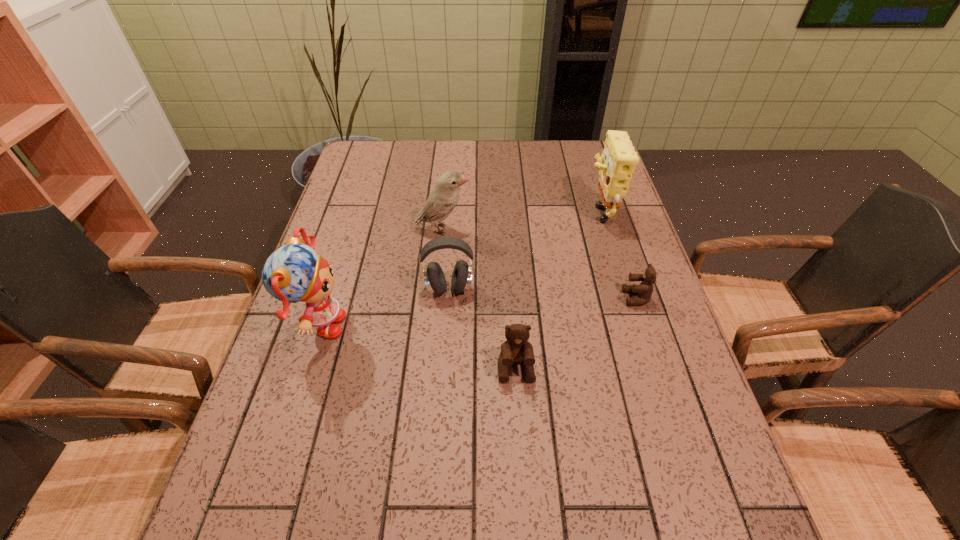
Where is `vacant space located 0.080m on the face of the shorter teddy bear`? Image resolution: width=960 pixels, height=540 pixels. vacant space located 0.080m on the face of the shorter teddy bear is located at coordinates (591, 298).

Locate an element on the screen. free space located on the face of the shorter teddy bear is located at coordinates (512, 298).

Locate an element on the screen. free region located at the face of the bird is located at coordinates (573, 230).

Locate an element on the screen. Image resolution: width=960 pixels, height=540 pixels. vacant space located on the face of the sponge is located at coordinates (566, 210).

You are a GUI agent. You are given a task and a screenshot of the screen. Output one action in this format:
    pyautogui.click(x=<x>, y=<y>)
    Task: Click on the free space located 0.220m on the face of the sponge
    
    Given the screenshot: What is the action you would take?
    pyautogui.click(x=512, y=210)

Where is `free region located on the face of the sponge`? The width and height of the screenshot is (960, 540). free region located on the face of the sponge is located at coordinates (531, 210).

Where is `free space located on the ear cups of the headset`? The image size is (960, 540). free space located on the ear cups of the headset is located at coordinates (444, 372).

You are a GUI agent. You are given a task and a screenshot of the screen. Output one action in this format:
    pyautogui.click(x=<x>, y=<y>)
    Task: Click on the free location located on the face of the doll
    This screenshot has width=960, height=540.
    Given the screenshot: What is the action you would take?
    pyautogui.click(x=441, y=327)

Identify the location of object that is at the left edge. This screenshot has height=540, width=960. (293, 273).

In order to click on teddy bear positioned at the right edge in this screenshot , I will do `click(645, 289)`.